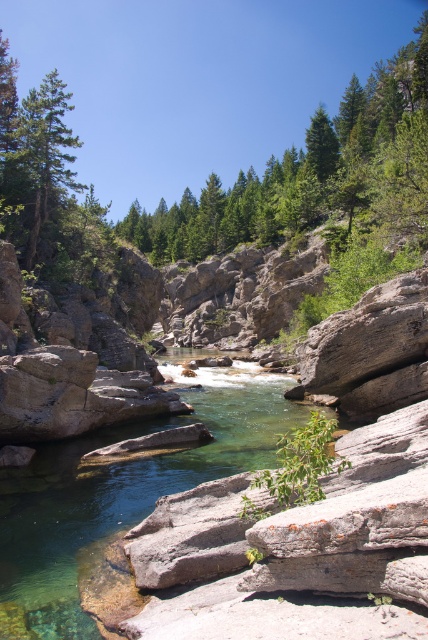
You are standing at the edge of the canyon and want to throw a stone to both point [36,579] and point [70,177] in the river. Which point will require you to throw the stone farther?

Point [70,177] will require you to throw the stone farther because it is farther from the viewer compared to point [36,579].

You are a hiker who wants to cross the river at the center of the canyon. There is a clear stone stream at center marked by point (121, 492). Can you safely step on that point to cross?

The point (121, 492) indicates clear stone stream at center, which is a safe area to step on for crossing since it is a solid stone surface.

Looking at this image, you are hiking along the canyon and want to take a photo of the clear stone stream at center and the green matte tree at upper left. Which object should you focus on first to ensure both are in sharp focus?

You should focus on the clear stone stream at center first because it is closer to you than the green matte tree at upper left, so focusing on the closer object will help both be in focus.